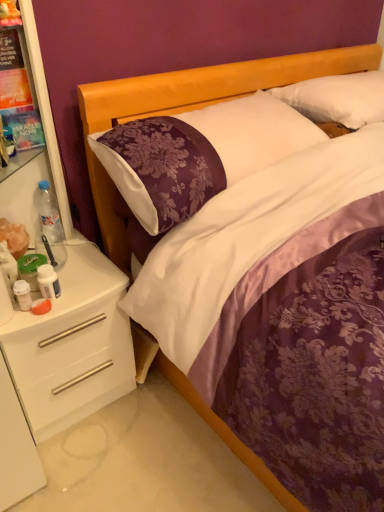
You are a GUI agent. You are given a task and a screenshot of the screen. Output one action in this format:
    pyautogui.click(x=<x>, y=<y>)
    Task: Click on the vacant area located to the right-hand side of white plastic bottle at left, the 2th bottle from the top
    This screenshot has width=384, height=512.
    Given the screenshot: What is the action you would take?
    pyautogui.click(x=90, y=294)